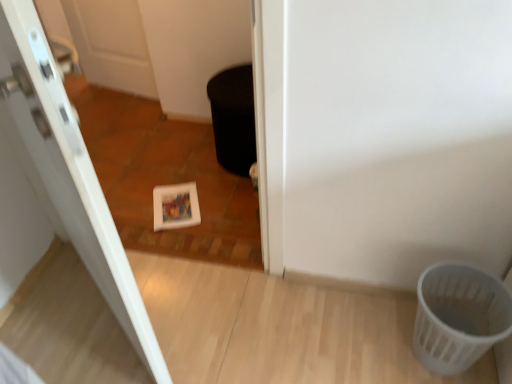
What do you see at coordinates (458, 316) in the screenshot? Image resolution: width=512 pixels, height=384 pixels. I see `white plastic basket at lower right` at bounding box center [458, 316].

Locate an element on the screen. This screenshot has width=512, height=384. black matte potty at center is located at coordinates (233, 118).

Locate an element on the screen. The image size is (512, 384). white glossy door at upper left is located at coordinates (67, 171).

Where is `white plastic basket at lower right`? This screenshot has width=512, height=384. white plastic basket at lower right is located at coordinates (458, 316).

Considering the relative positions of white plastic basket at lower right and white glossy door at upper left in the image provided, is white plastic basket at lower right to the left or to the right of white glossy door at upper left?

white plastic basket at lower right is to the right of white glossy door at upper left.

How distant is white plastic basket at lower right from white glossy door at upper left?

white plastic basket at lower right and white glossy door at upper left are 39.36 inches apart.

Choose the correct answer: Is white plastic basket at lower right inside white glossy door at upper left or outside it?

white plastic basket at lower right lies outside white glossy door at upper left.

Which of these two, white plastic basket at lower right or white glossy door at upper left, is smaller?

With smaller size is white plastic basket at lower right.

At what (x,y) coordinates should I click in order to perform the action: click on door located in front of the white plastic basket at lower right. Please return your answer as a coordinate pair (x, y). This screenshot has height=384, width=512. Looking at the image, I should click on (67, 171).

From a real-world perspective, is white glossy door at upper left beneath white plastic basket at lower right?

No, from a real-world perspective, white glossy door at upper left is not beneath white plastic basket at lower right.

Is white glossy door at upper left surrounding white plastic basket at lower right?

Definitely not — white plastic basket at lower right is not inside white glossy door at upper left.

Looking at this image, from their relative heights in the image, would you say black matte potty at center is taller or shorter than white glossy door at upper left?

Clearly, black matte potty at center is shorter compared to white glossy door at upper left.

From the image's perspective, which is above, black matte potty at center or white glossy door at upper left?

From the image's view, black matte potty at center is above.

Locate an element on the screen. door below the black matte potty at center (from the image's perspective) is located at coordinates (67, 171).

Is black matte potty at center oriented towards white glossy door at upper left?

Yes, black matte potty at center is turned towards white glossy door at upper left.

Does white plastic basket at lower right appear on the right side of black matte potty at center?

Indeed, white plastic basket at lower right is positioned on the right side of black matte potty at center.

Is white plastic basket at lower right situated inside black matte potty at center or outside?

white plastic basket at lower right is not enclosed by black matte potty at center.

Is white plastic basket at lower right shorter than black matte potty at center?

Correct, white plastic basket at lower right is not as tall as black matte potty at center.

Is white plastic basket at lower right with black matte potty at center?

white plastic basket at lower right and black matte potty at center are clearly separated.

Based on the photo, is black matte potty at center turned away from white plastic basket at lower right?

No, white plastic basket at lower right is not at the back of black matte potty at center.

Which is in front, point (245, 121) or point (454, 295)?

Positioned in front is point (454, 295).

Is black matte potty at center completely or partially outside of white plastic basket at lower right?

Yes.

From the image's perspective, between black matte potty at center and white plastic basket at lower right, which one is located above?

black matte potty at center appears higher in the image.

The image size is (512, 384). Find the location of `potty located above the white glossy door at upper left (from the image's perspective)`. potty located above the white glossy door at upper left (from the image's perspective) is located at coordinates pyautogui.click(x=233, y=118).

From the image's perspective, relative to black matte potty at center, is white glossy door at upper left above or below?

Based on their image positions, white glossy door at upper left is located beneath black matte potty at center.

Does white glossy door at upper left have a larger size compared to black matte potty at center?

Yes, white glossy door at upper left is bigger than black matte potty at center.

How many degrees apart are the facing directions of white glossy door at upper left and black matte potty at center?

The angular difference between white glossy door at upper left and black matte potty at center is 136 degrees.

Identify the location of basket behind the white glossy door at upper left. Image resolution: width=512 pixels, height=384 pixels. (458, 316).

The height and width of the screenshot is (384, 512). I want to click on basket beneath the white glossy door at upper left (from a real-world perspective), so click(458, 316).

Based on their spatial positions, is white plastic basket at lower right or white glossy door at upper left closer to black matte potty at center?

white glossy door at upper left is closer to black matte potty at center.

Based on their spatial positions, is black matte potty at center or white glossy door at upper left further from white plastic basket at lower right?

black matte potty at center.

Estimate the real-world distances between objects in this image. Which object is closer to white glossy door at upper left, white plastic basket at lower right or black matte potty at center?

black matte potty at center.

From the image, which object appears to be farther from black matte potty at center, white glossy door at upper left or white plastic basket at lower right?

Among the two, white plastic basket at lower right is located further to black matte potty at center.

Looking at the image, which one is located further to white glossy door at upper left, black matte potty at center or white plastic basket at lower right?

white plastic basket at lower right lies further to white glossy door at upper left than the other object.

Looking at this image, looking at the image, which one is located closer to white plastic basket at lower right, white glossy door at upper left or black matte potty at center?

Based on the image, white glossy door at upper left appears to be nearer to white plastic basket at lower right.

Locate an element on the screen. The image size is (512, 384). basket located between white glossy door at upper left and black matte potty at center in the depth direction is located at coordinates (458, 316).